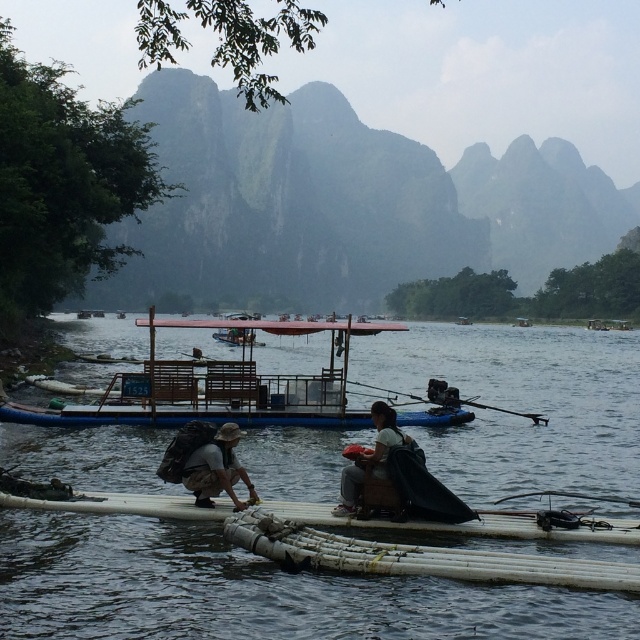
You are planning to take a boat ride on this river. You have to choose between the wooden boat at center and the natural bamboo raft at lower center. Which one would you choose if you want a bigger vessel for more passengers?

The wooden boat at center is larger in size than the natural bamboo raft at lower center, so you should choose the wooden boat at center for a bigger vessel that can accommodate more passengers.

You are standing on the riverside and see the white bamboo raft at center and the natural bamboo raft at lower center. Which raft is positioned higher in the image?

The white bamboo raft at center is positioned higher in the image as it is above the natural bamboo raft at lower center.